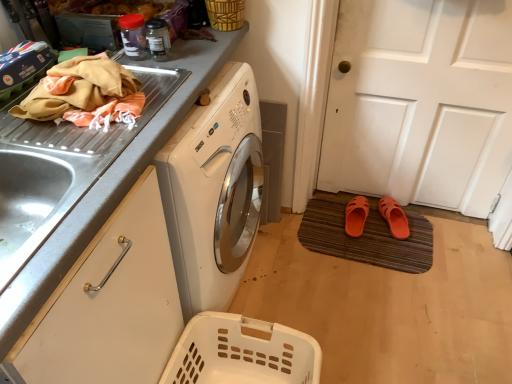
Where is `unoccupied space behind orange rubber slipper at lower center, arranged as the first footwear when viewed from the left`? Image resolution: width=512 pixels, height=384 pixels. unoccupied space behind orange rubber slipper at lower center, arranged as the first footwear when viewed from the left is located at coordinates (333, 201).